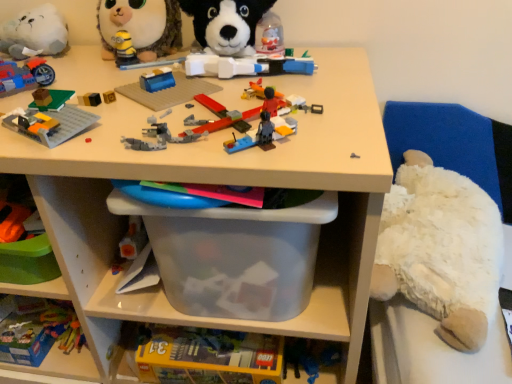
The image size is (512, 384). Find the location of `free spot to the left of white plush dog at upper center, the seventh toy viewed from the left`. free spot to the left of white plush dog at upper center, the seventh toy viewed from the left is located at coordinates (140, 74).